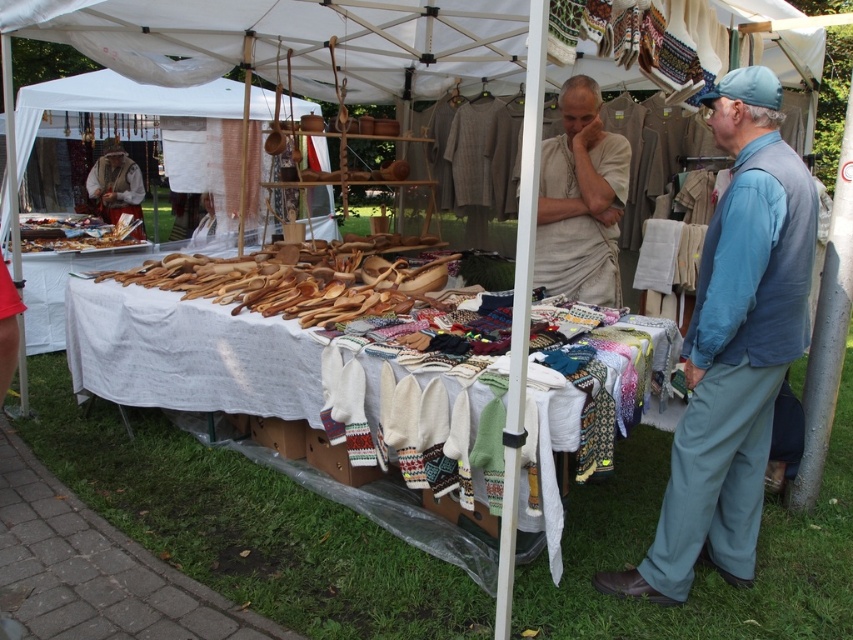
Question: Does blue cotton vest at right have a smaller size compared to red fabric dress at lower left?

Choices:
 (A) no
 (B) yes

Answer: (A)

Question: Can you confirm if blue cotton vest at right is positioned to the right of white woven fabric at center?

Choices:
 (A) yes
 (B) no

Answer: (A)

Question: Which object is farther from the camera taking this photo?

Choices:
 (A) blue cotton vest at right
 (B) white woven fabric at center
 (C) red fabric dress at lower left

Answer: (B)

Question: Is beige linen shirt at center positioned at the back of white knitted mittens at center?

Choices:
 (A) no
 (B) yes

Answer: (A)

Question: Which object is closer to the camera taking this photo?

Choices:
 (A) white knitted mittens at center
 (B) white woven fabric at center
 (C) blue cotton vest at right
 (D) beige linen shirt at center

Answer: (C)

Question: Estimate the real-world distances between objects in this image. Which object is closer to the blue cotton vest at right?

Choices:
 (A) red fabric dress at lower left
 (B) beige linen shirt at center
 (C) white woven fabric at center
 (D) white knitted mittens at center

Answer: (B)